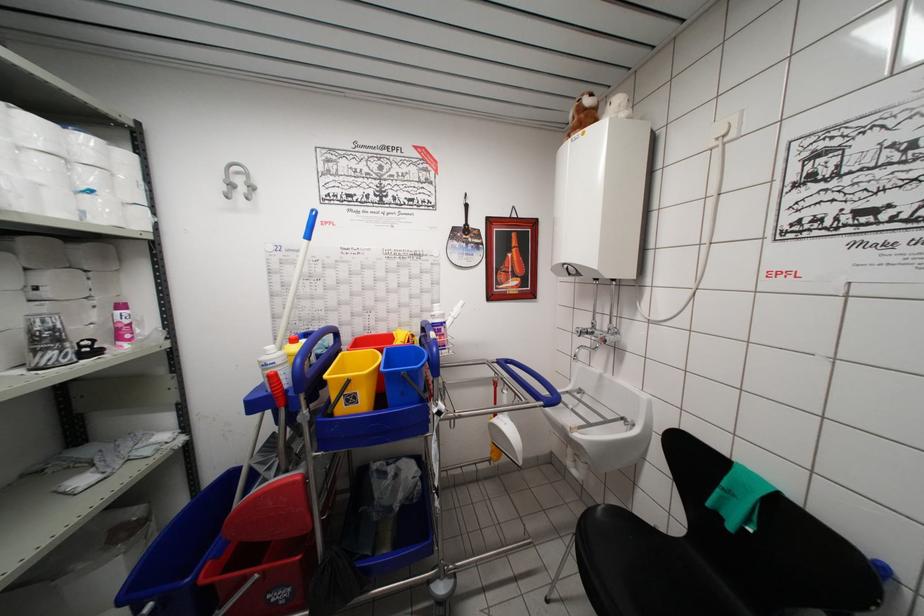
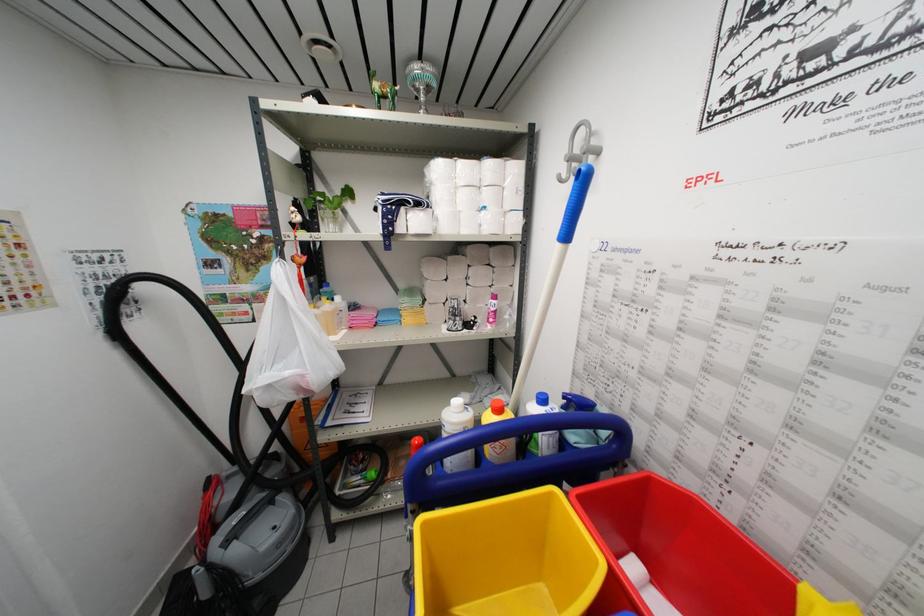
In the scene shown: The images are taken continuously from a first-person perspective. In which direction is your viewpoint rotating?

The rotation direction of the camera is left-down.